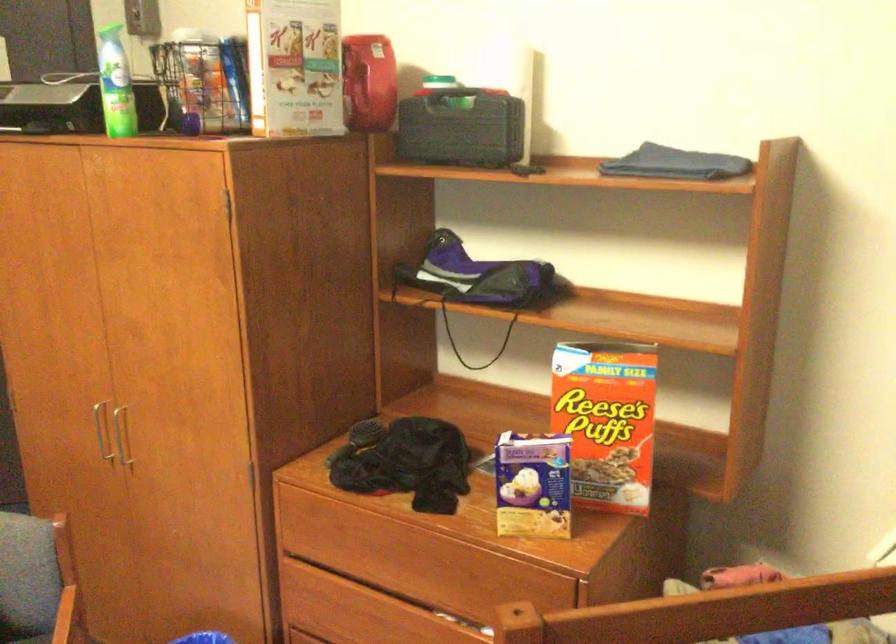
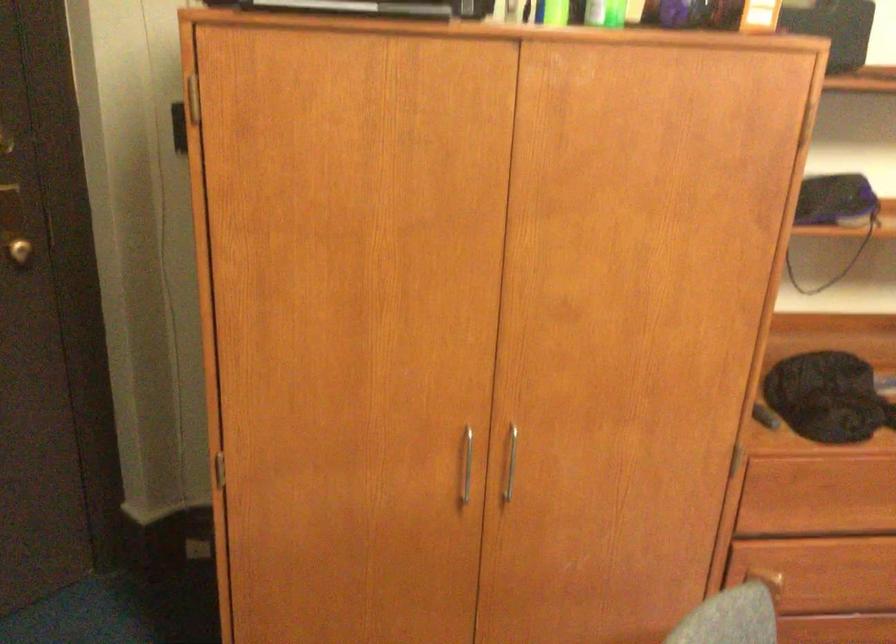
Question: I am providing you with two images of the same scene from different viewpoints. Which of the following objects are not visible in image2?

Choices:
 (A) drawer handle
 (B) purple and black bag
 (C) green plastic bottle
 (D) backpack strap

Answer: (B)